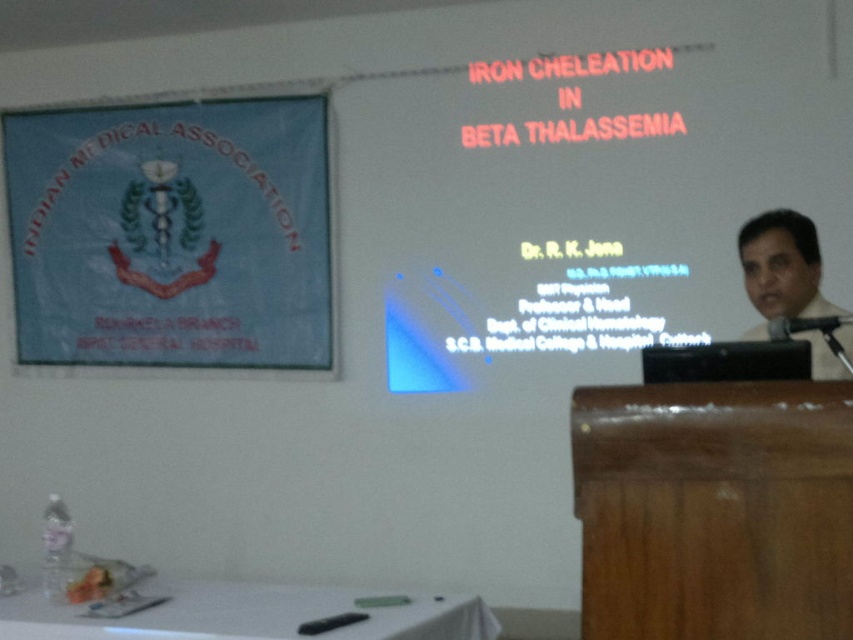
Can you confirm if blue fabric banner at upper left is positioned to the right of dark gray shirt at right?

Incorrect, blue fabric banner at upper left is not on the right side of dark gray shirt at right.

Is blue fabric banner at upper left thinner than dark gray shirt at right?

Incorrect, blue fabric banner at upper left's width is not less than dark gray shirt at right's.

Is point (109, 342) closer to viewer compared to point (820, 298)?

No.

Identify the location of blue fabric banner at upper left. The width and height of the screenshot is (853, 640). (172, 234).

Does point (85, 636) lie in front of point (761, 243)?

Yes, it is.

Does white plastic table at lower center have a larger size compared to dark gray shirt at right?

Yes.

This screenshot has height=640, width=853. I want to click on white plastic table at lower center, so click(253, 614).

Consider the image. Between blue fabric banner at upper left and white plastic table at lower center, which one has less height?

Standing shorter between the two is white plastic table at lower center.

Who is higher up, blue fabric banner at upper left or white plastic table at lower center?

blue fabric banner at upper left is above.

The width and height of the screenshot is (853, 640). I want to click on blue fabric banner at upper left, so click(x=172, y=234).

What are the coordinates of `blue fabric banner at upper left` in the screenshot? It's located at (172, 234).